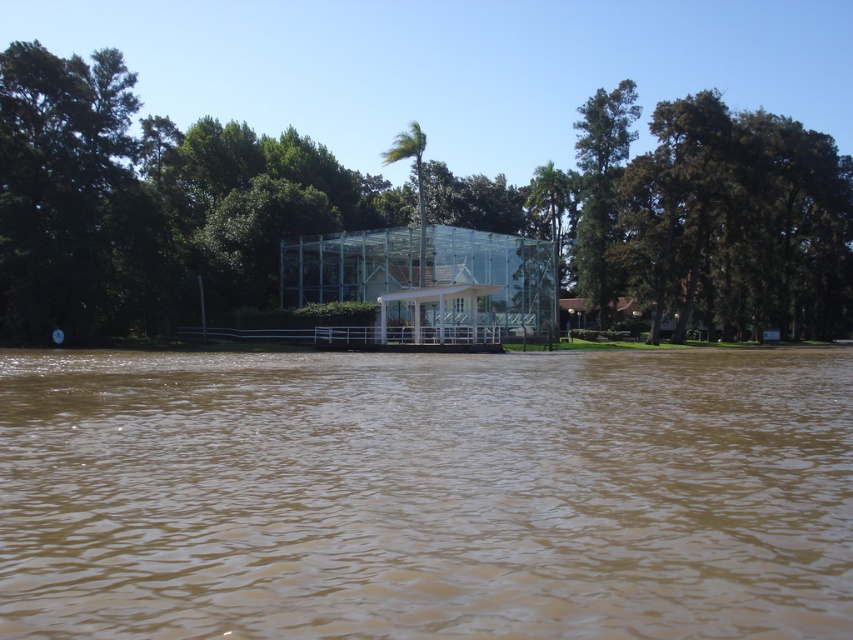
Question: Does brown muddy water at center have a greater width compared to green leafy tree at upper right?

Choices:
 (A) no
 (B) yes

Answer: (A)

Question: Is brown muddy water at center positioned at the back of green leafy tree at center?

Choices:
 (A) yes
 (B) no

Answer: (B)

Question: Which object is the farthest from the green leafy tree at upper right?

Choices:
 (A) brown muddy water at center
 (B) green leafy tree at center

Answer: (A)

Question: Is brown muddy water at center to the left of green leafy tree at center from the viewer's perspective?

Choices:
 (A) no
 (B) yes

Answer: (B)

Question: Which point appears farthest from the camera in this image?

Choices:
 (A) (595, 188)
 (B) (743, 508)
 (C) (837, 204)

Answer: (C)

Question: Which point appears farthest from the camera in this image?

Choices:
 (A) (91, 588)
 (B) (608, 296)

Answer: (B)